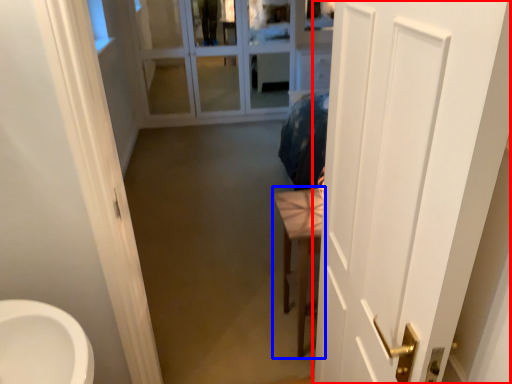
Question: Which of the following is the closest to the observer, door (highlighted by a red box) or furniture (highlighted by a blue box)?

Choices:
 (A) door
 (B) furniture

Answer: (A)